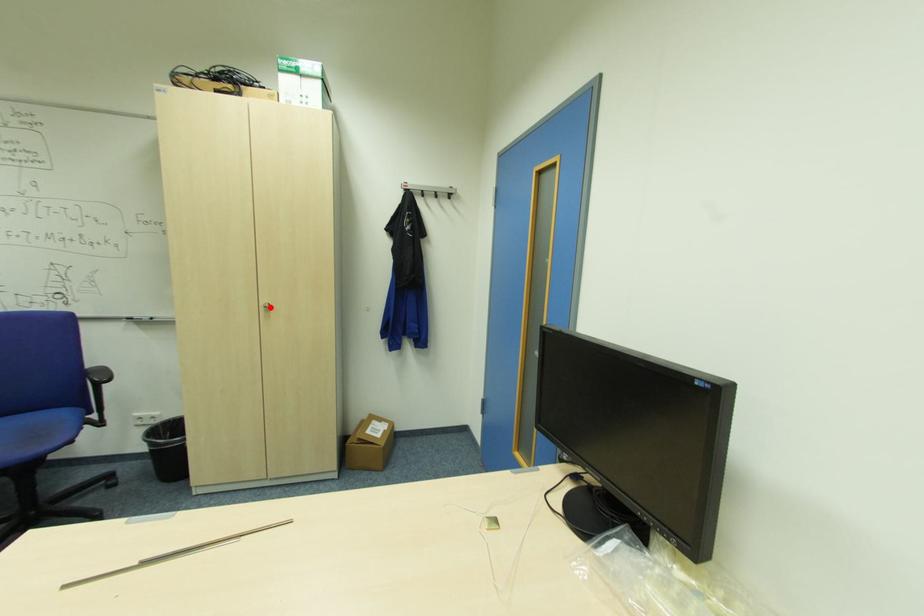
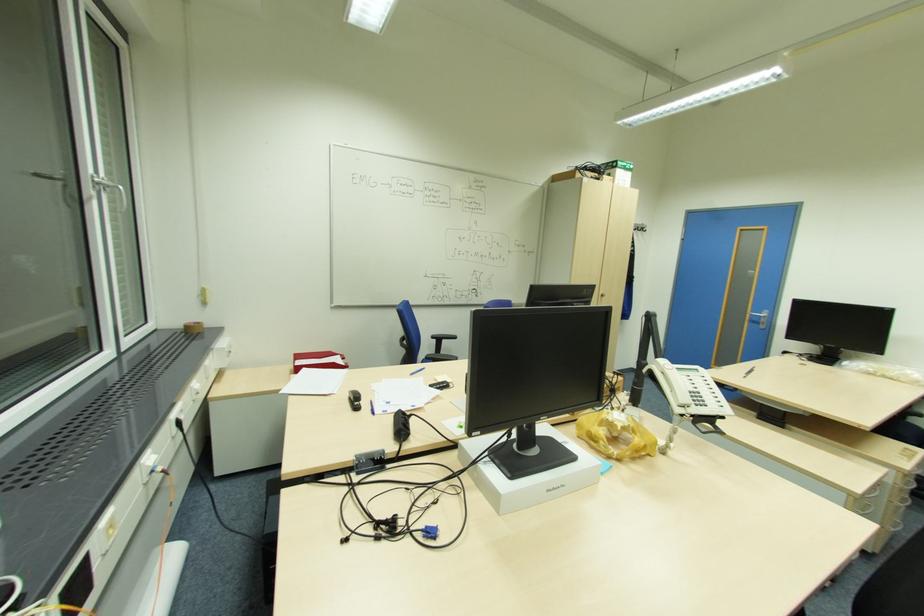
Question: I am providing you with two images of the same scene from different viewpoints. A red point is shown in image1. For the corresponding object point in image2, is it positioned nearer or farther from the camera?

Choices:
 (A) Nearer
 (B) Farther

Answer: (B)